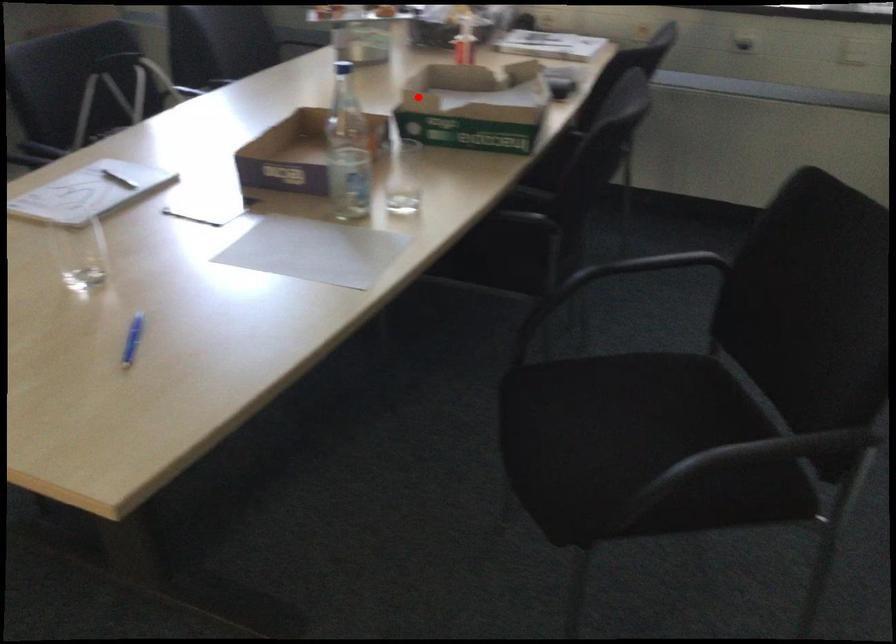
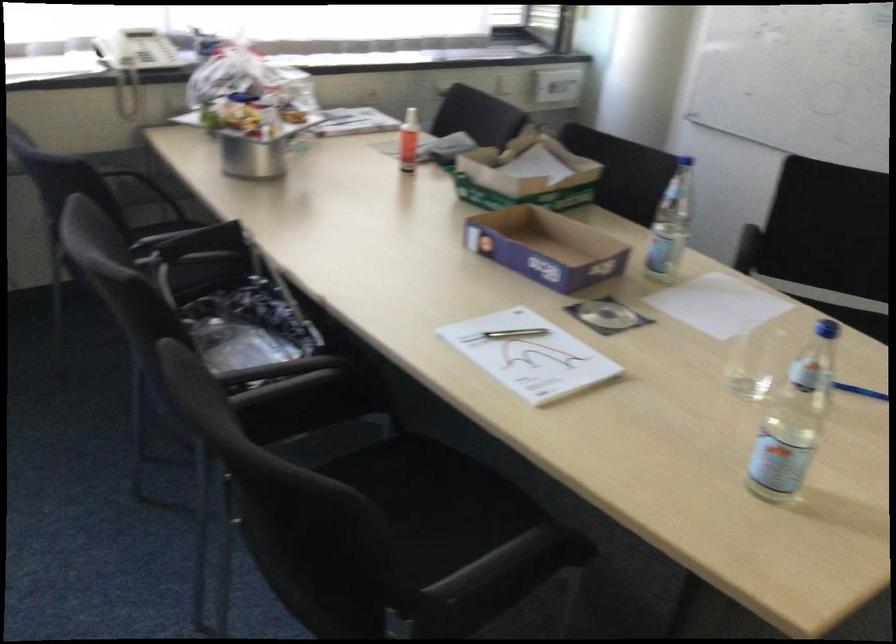
The point at the highlighted location is marked in the first image. Where is the corresponding point in the second image?

(526, 175)